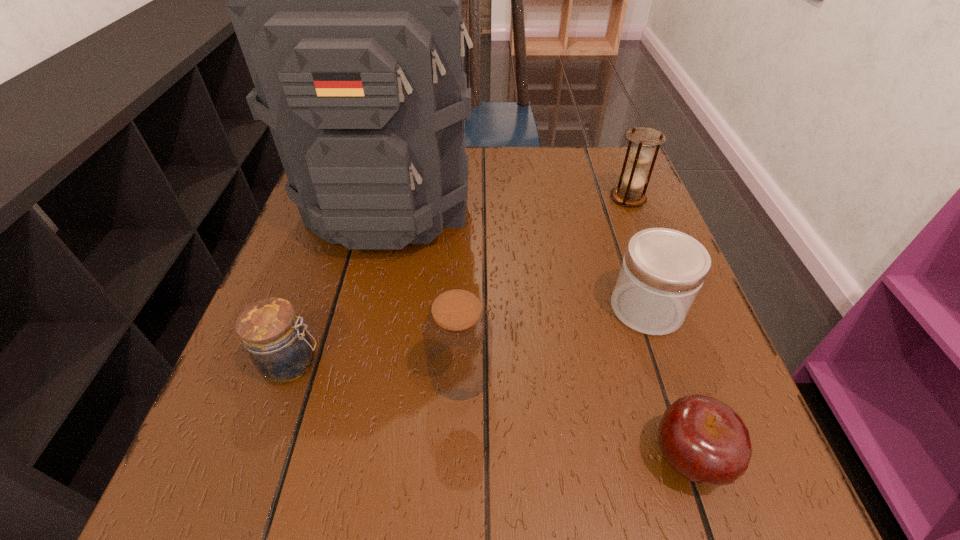
In order to click on backpack in this screenshot , I will do `click(346, 0)`.

Locate an element on the screen. hourglass is located at coordinates (x=640, y=155).

Image resolution: width=960 pixels, height=540 pixels. In order to click on the second jar from right to left in this screenshot , I will do `click(458, 333)`.

Find the location of a particular element. This screenshot has width=960, height=540. the farthest jar is located at coordinates (663, 270).

Locate an element on the screen. the rightmost jar is located at coordinates (663, 270).

The width and height of the screenshot is (960, 540). I want to click on the leftmost jar, so click(x=280, y=348).

You are a GUI agent. You are given a task and a screenshot of the screen. Output one action in this format:
    pyautogui.click(x=<x>, y=<y>)
    Task: Click on the apple
    The image size is (960, 540).
    Given the screenshot: What is the action you would take?
    pyautogui.click(x=705, y=441)

Locate an element on the screen. This screenshot has width=960, height=540. blank area located 0.170m on the front compartment of the backpack is located at coordinates (362, 333).

You are a GUI agent. You are given a task and a screenshot of the screen. Output one action in this format:
    pyautogui.click(x=<x>, y=<y>)
    Task: Click on the free space located on the left of the hourglass
    The image size is (960, 540).
    Given the screenshot: What is the action you would take?
    pyautogui.click(x=551, y=198)

The height and width of the screenshot is (540, 960). I want to click on free location located on the back of the second jar from right to left, so click(x=466, y=224).